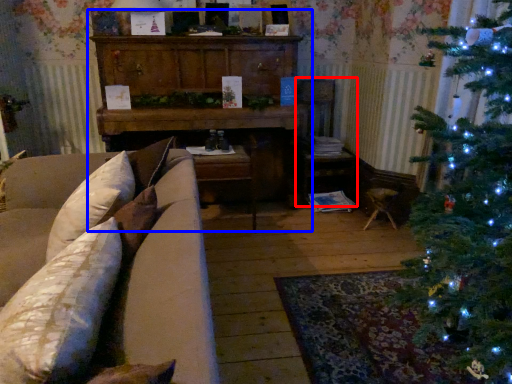
Question: Which point is further to the camera, armchair (highlighted by a red box) or dresser (highlighted by a blue box)?

Choices:
 (A) armchair
 (B) dresser

Answer: (A)